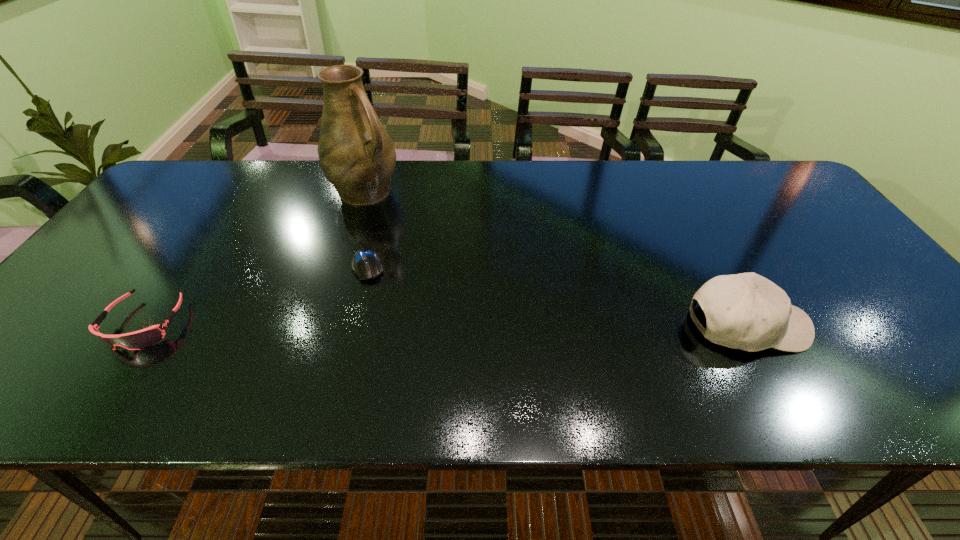
Identify the location of blank area in the image that satisfies the following two spatial constraints: 1. on the front side of the third nearest object; 2. on the left side of the tallest object. (341, 266).

The width and height of the screenshot is (960, 540). I want to click on free space in the image that satisfies the following two spatial constraints: 1. on the front-facing side of the leftmost object; 2. on the front-facing side of the third shortest object, so click(x=144, y=325).

Locate an element on the screen. vacant region that satisfies the following two spatial constraints: 1. on the front-facing side of the goggles; 2. on the front-facing side of the second tallest object is located at coordinates (144, 325).